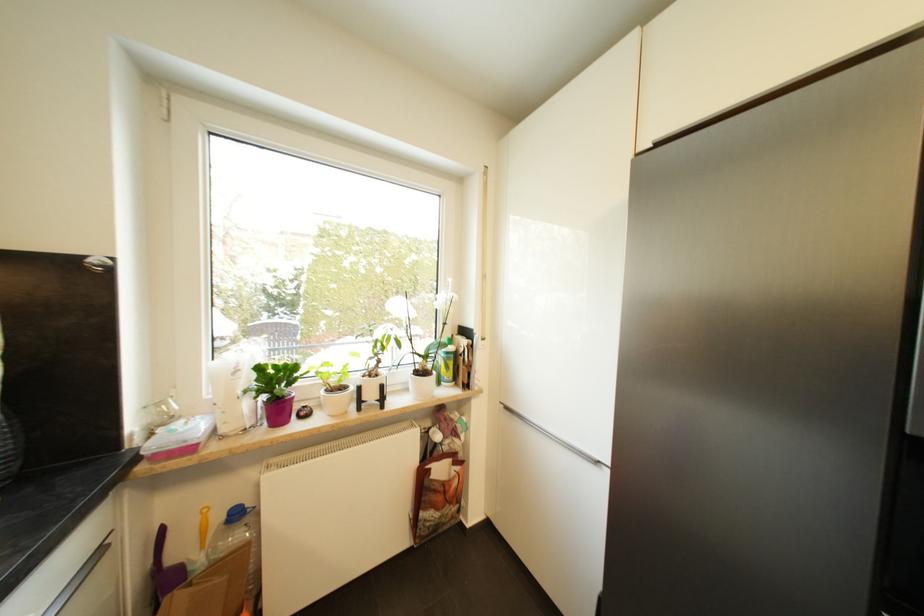
Where would you pull the silver cabinet handle? Please return your answer as a coordinate pair (x, y).

(551, 435)